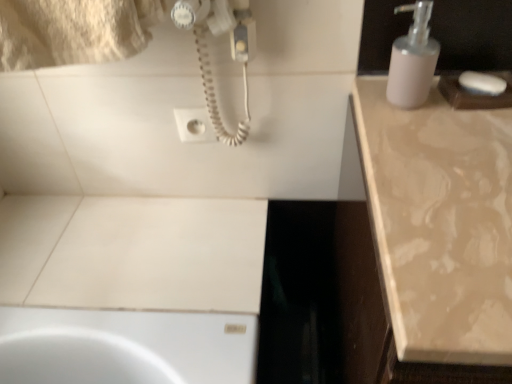
Question: Does beige marble countertop at right have a greater height compared to white plastic socket at upper center?

Choices:
 (A) yes
 (B) no

Answer: (A)

Question: From a real-world perspective, is beige marble countertop at right on white plastic socket at upper center?

Choices:
 (A) yes
 (B) no

Answer: (B)

Question: Is white plastic socket at upper center completely or partially inside beige marble countertop at right?

Choices:
 (A) no
 (B) yes

Answer: (A)

Question: Can you confirm if beige marble countertop at right is smaller than white plastic socket at upper center?

Choices:
 (A) yes
 (B) no

Answer: (B)

Question: Is beige marble countertop at right turned away from white plastic socket at upper center?

Choices:
 (A) yes
 (B) no

Answer: (B)

Question: Does beige marble countertop at right appear on the left side of white plastic socket at upper center?

Choices:
 (A) yes
 (B) no

Answer: (B)

Question: Can you confirm if white matte soap at upper right is smaller than beige marble countertop at right?

Choices:
 (A) no
 (B) yes

Answer: (B)

Question: Does white matte soap at upper right appear on the right side of beige marble countertop at right?

Choices:
 (A) yes
 (B) no

Answer: (B)

Question: From a real-world perspective, is white matte soap at upper right physically above beige marble countertop at right?

Choices:
 (A) yes
 (B) no

Answer: (A)

Question: Is beige marble countertop at right inside white matte soap at upper right?

Choices:
 (A) no
 (B) yes

Answer: (A)

Question: Is white matte soap at upper right shorter than beige marble countertop at right?

Choices:
 (A) yes
 (B) no

Answer: (A)

Question: Is white matte soap at upper right not inside beige marble countertop at right?

Choices:
 (A) yes
 (B) no

Answer: (A)

Question: From a real-world perspective, does white matte soap dispenser at upper right sit lower than white matte soap at upper right?

Choices:
 (A) yes
 (B) no

Answer: (B)